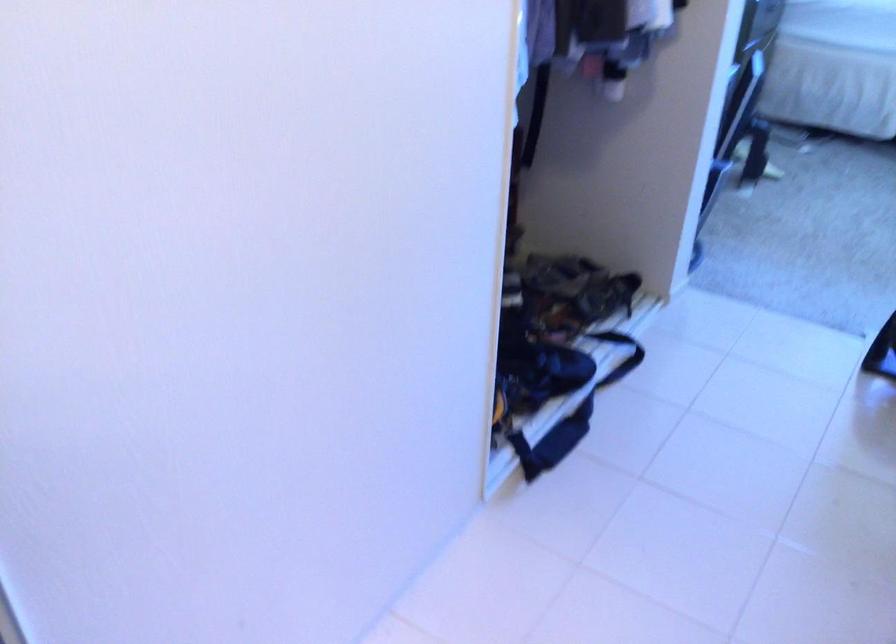
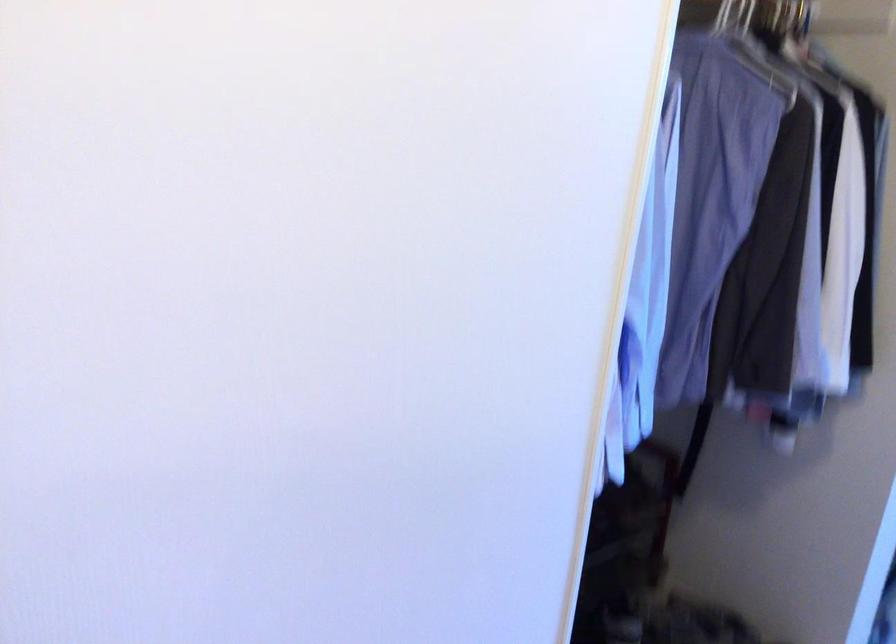
In a continuous first-person perspective shot, in which direction is the camera moving?

The movement direction of the cameraman is right, forward.